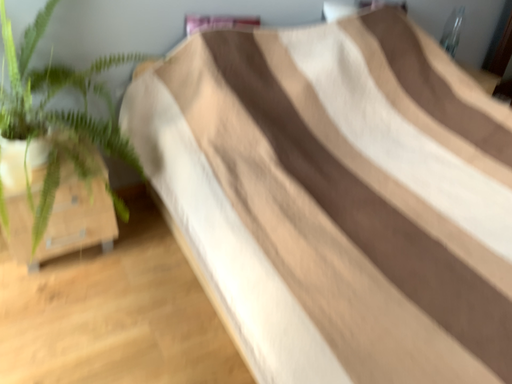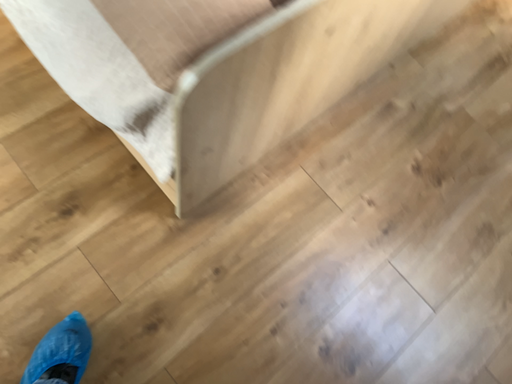
Question: How did the camera likely rotate when shooting the video?

Choices:
 (A) rotated downward
 (B) rotated upward

Answer: (A)